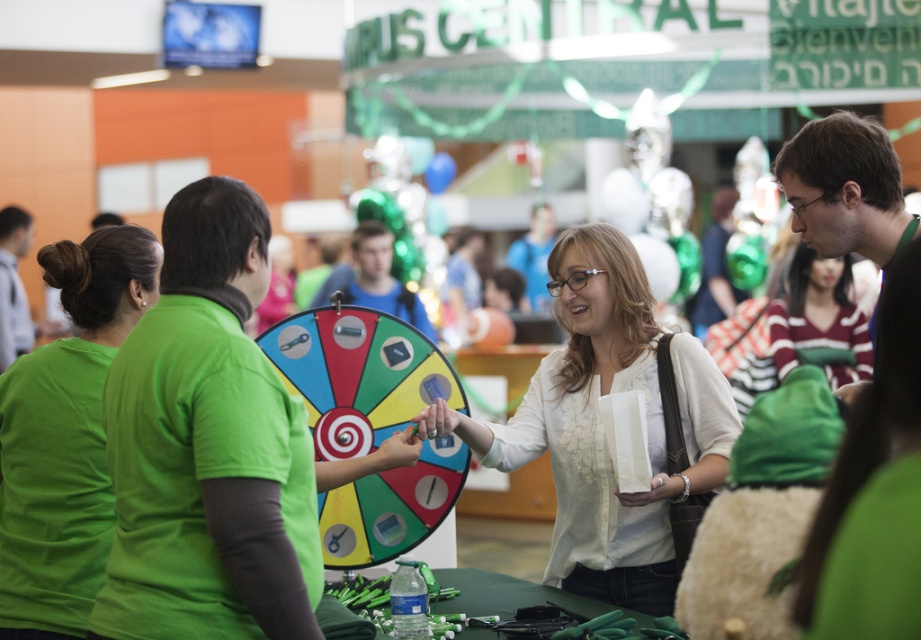
Question: Is green matte shirt at center smaller than matte blue shirt at center?

Choices:
 (A) no
 (B) yes

Answer: (B)

Question: Which object is the closest to the green matte shirt at upper left?

Choices:
 (A) matte black shirt at center
 (B) green t-shirt at left
 (C) green matte shirt at center
 (D) matte blue shirt at center

Answer: (C)

Question: Does green matte shirt at center appear on the left side of matte black shirt at center?

Choices:
 (A) no
 (B) yes

Answer: (B)

Question: Does matte blue shirt at center come behind green t-shirt at left?

Choices:
 (A) no
 (B) yes

Answer: (A)

Question: Which point is farther to the camera?

Choices:
 (A) striped knit sweater at center
 (B) matte black shirt at center
 (C) green matte shirt at upper left
 (D) green matte shirt at center

Answer: (A)

Question: Among these objects, which one is farthest from the camera?

Choices:
 (A) matte blue shirt at center
 (B) striped knit sweater at center
 (C) green matte shirt at upper left
 (D) matte black shirt at center

Answer: (A)